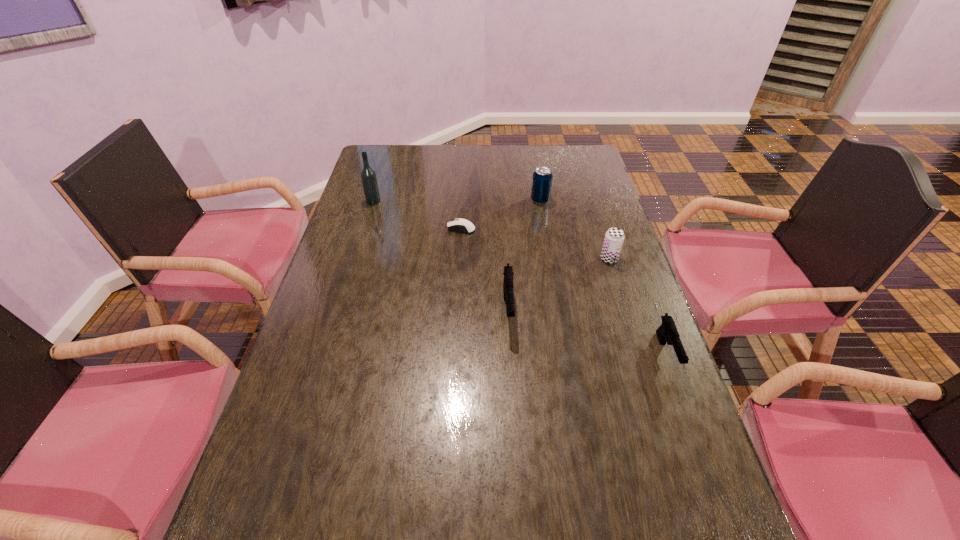
At what (x,y) coordinates should I click in order to perform the action: click on the left pistol. Please return your answer as a coordinate pair (x, y). Looking at the image, I should click on (508, 292).

The height and width of the screenshot is (540, 960). Identify the location of the taller pistol. (508, 292).

This screenshot has height=540, width=960. Find the location of `the shorter pistol`. the shorter pistol is located at coordinates (667, 332).

At what (x,y) coordinates should I click in order to perform the action: click on the right pistol. Please return your answer as a coordinate pair (x, y). Looking at the image, I should click on (667, 332).

Locate an element on the screen. This screenshot has width=960, height=540. beer can is located at coordinates (614, 237).

Identify the location of the second object from right to left. This screenshot has width=960, height=540. (614, 237).

This screenshot has height=540, width=960. Identify the location of the third object from right to left. (542, 177).

The image size is (960, 540). What are the coordinates of `mouse` in the screenshot? It's located at (461, 225).

Find the location of a particular element. This screenshot has height=540, width=960. the third farthest object is located at coordinates (461, 225).

Identify the location of vodka. The width and height of the screenshot is (960, 540). (368, 176).